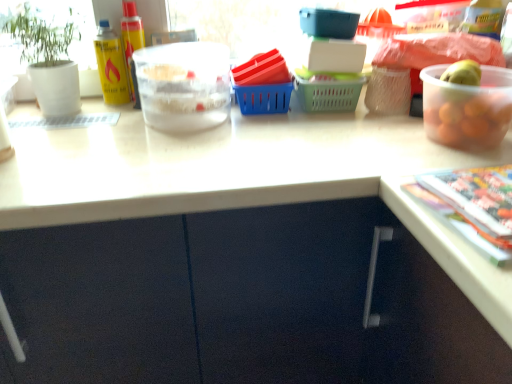
Question: From the image's perspective, does translucent plastic bowl at upper center, positioned as the 2th bowl in front-to-back order, appear lower than multicolored glossy magazine at lower right?

Choices:
 (A) no
 (B) yes

Answer: (A)

Question: From a real-world perspective, is translucent plastic bowl at upper center, marked as the second bowl in a right-to-left arrangement, on multicolored glossy magazine at lower right?

Choices:
 (A) no
 (B) yes

Answer: (B)

Question: Is translucent plastic bowl at upper center, positioned as the 2th bowl in front-to-back order, bigger than multicolored glossy magazine at lower right?

Choices:
 (A) yes
 (B) no

Answer: (A)

Question: Could you tell me if translucent plastic bowl at upper center, marked as the first bowl in a back-to-front arrangement, is facing multicolored glossy magazine at lower right?

Choices:
 (A) no
 (B) yes

Answer: (A)

Question: Would you consider translucent plastic bowl at upper center, marked as the first bowl in a back-to-front arrangement, to be distant from multicolored glossy magazine at lower right?

Choices:
 (A) no
 (B) yes

Answer: (A)

Question: Considering the positions of transparent plastic bowl at upper right, placed as the 2th bowl when sorted from left to right, and green matte plant pot at left in the image, is transparent plastic bowl at upper right, placed as the 2th bowl when sorted from left to right, taller or shorter than green matte plant pot at left?

Choices:
 (A) short
 (B) tall

Answer: (A)

Question: Which is correct: transparent plastic bowl at upper right, which is the second bowl in back-to-front order, is inside green matte plant pot at left, or outside of it?

Choices:
 (A) outside
 (B) inside

Answer: (A)

Question: Would you say transparent plastic bowl at upper right, which is the second bowl in back-to-front order, is to the left or to the right of green matte plant pot at left in the picture?

Choices:
 (A) left
 (B) right

Answer: (B)

Question: Looking at their shapes, would you say transparent plastic bowl at upper right, placed as the first bowl when sorted from right to left, is wider or thinner than green matte plant pot at left?

Choices:
 (A) wide
 (B) thin

Answer: (B)

Question: In terms of height, does transparent plastic bowl at upper right, placed as the first bowl when sorted from right to left, look taller or shorter compared to translucent plastic bowl at upper center, marked as the second bowl in a right-to-left arrangement?

Choices:
 (A) short
 (B) tall

Answer: (B)

Question: From a real-world perspective, relative to translucent plastic bowl at upper center, marked as the first bowl in a back-to-front arrangement, is transparent plastic bowl at upper right, which is the second bowl in back-to-front order, vertically above or below?

Choices:
 (A) below
 (B) above

Answer: (B)

Question: Is point (443, 87) positioned closer to the camera than point (221, 72)?

Choices:
 (A) farther
 (B) closer

Answer: (B)

Question: From the image's perspective, relative to translucent plastic bowl at upper center, marked as the first bowl in a back-to-front arrangement, is transparent plastic bowl at upper right, placed as the first bowl when sorted from right to left, above or below?

Choices:
 (A) above
 (B) below

Answer: (B)

Question: Visually, is transparent plastic bowl at upper right, placed as the 2th bowl when sorted from left to right, positioned to the left or to the right of multicolored glossy magazine at lower right?

Choices:
 (A) left
 (B) right

Answer: (A)

Question: Relative to multicolored glossy magazine at lower right, is transparent plastic bowl at upper right, which is the second bowl in back-to-front order, in front or behind?

Choices:
 (A) behind
 (B) front

Answer: (A)